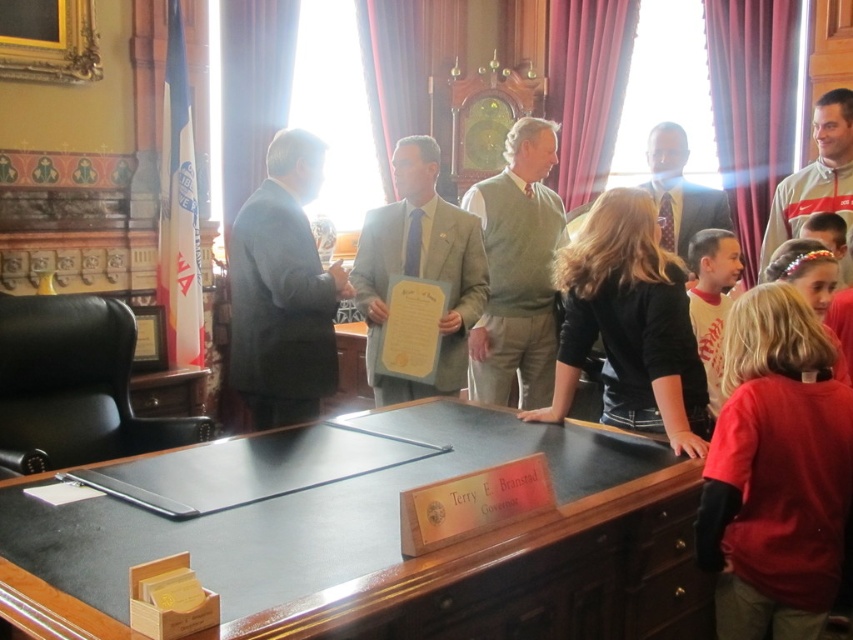
You are standing in the office of Governor Branstad and want to place a new document organizer on the desk. The organizer requires a space that is exactly 8.74 feet away from your current position. Can you place it at the point marked by the coordinates point (x=305, y=429)?

Yes, the point marked by the coordinates point (x=305, y=429) is exactly 8.74 feet away from your current position, so you can place the document organizer there.

You are an office assistant who needs to place a new item on the desk. The desk has limited space. Which object, the red fleece jacket at lower right or the wooden plaque at center, is more likely to have enough space if you want to place a new item next to it?

The wooden plaque at center is narrower than the red fleece jacket at lower right, so placing a new item next to the wooden plaque at center would have more available space.